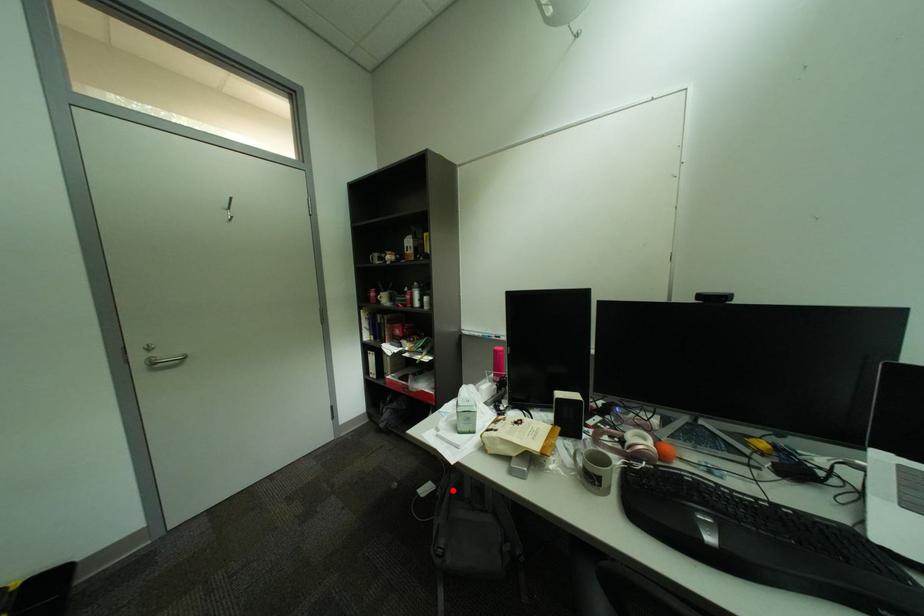
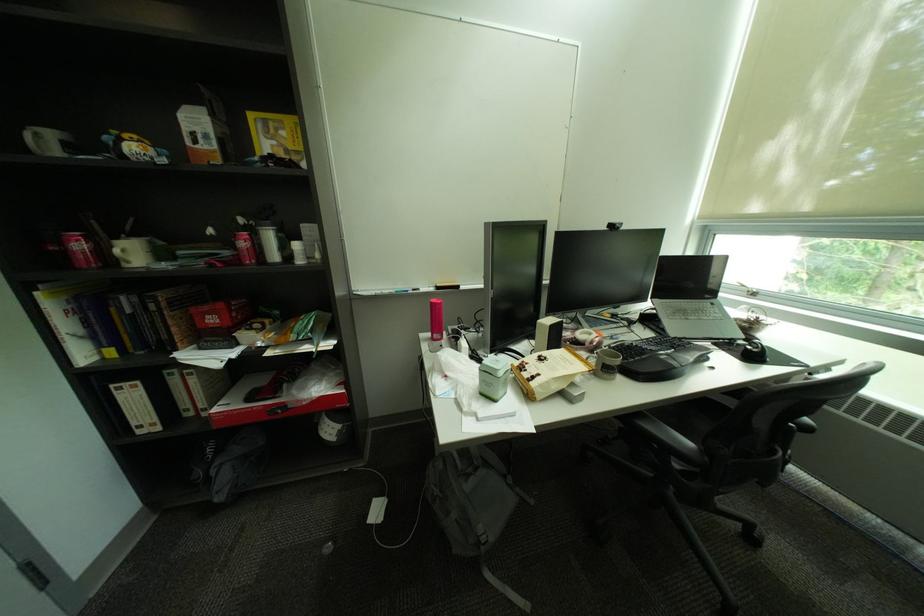
In the second image, find the point that corresponds to the highlighted location in the first image.

(446, 487)